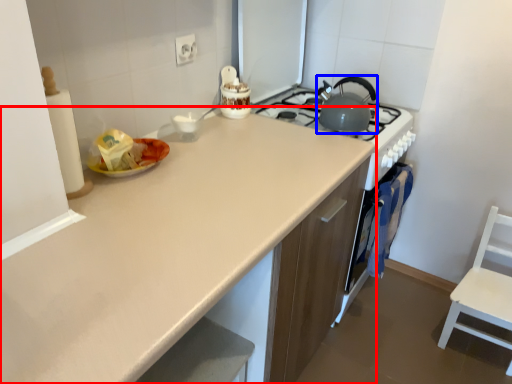
Question: Among these objects, which one is farthest to the camera, countertop (highlighted by a red box) or kitchen appliance (highlighted by a blue box)?

Choices:
 (A) countertop
 (B) kitchen appliance

Answer: (B)